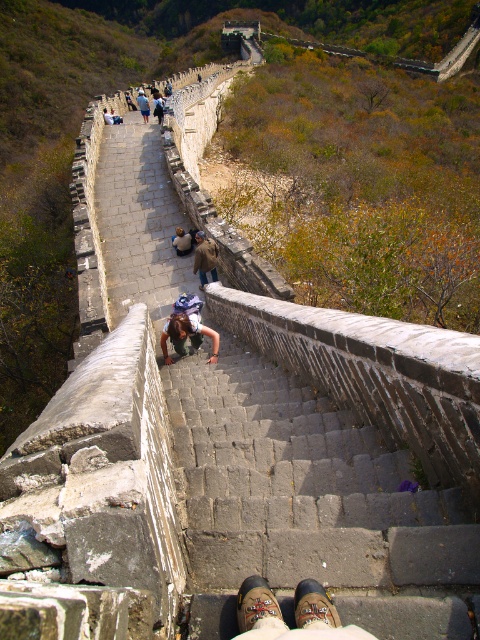
Question: Which object is the farthest from the blue denim jeans at center?

Choices:
 (A) brown leather shoes at lower center
 (B) gray stone stairs at center

Answer: (A)

Question: Does blue denim jeans at center appear on the right side of denim jacket at upper center?

Choices:
 (A) yes
 (B) no

Answer: (A)

Question: Which is nearer to the brown leather backpack at center?

Choices:
 (A) brown leather shoes at lower center
 (B) denim jacket at upper center
 (C) gray stone stairs at center
 (D) light blue denim jeans at center

Answer: (C)

Question: In this image, where is blue denim jeans at center located relative to denim jacket at upper center?

Choices:
 (A) right
 (B) left

Answer: (A)

Question: Can you confirm if brown leather backpack at center is wider than light blue denim jeans at center?

Choices:
 (A) no
 (B) yes

Answer: (A)

Question: Which of these objects is positioned closest to the gray stone stairs at center?

Choices:
 (A) denim jacket at upper center
 (B) brown leather shoes at lower center
 (C) blue denim jeans at center

Answer: (B)